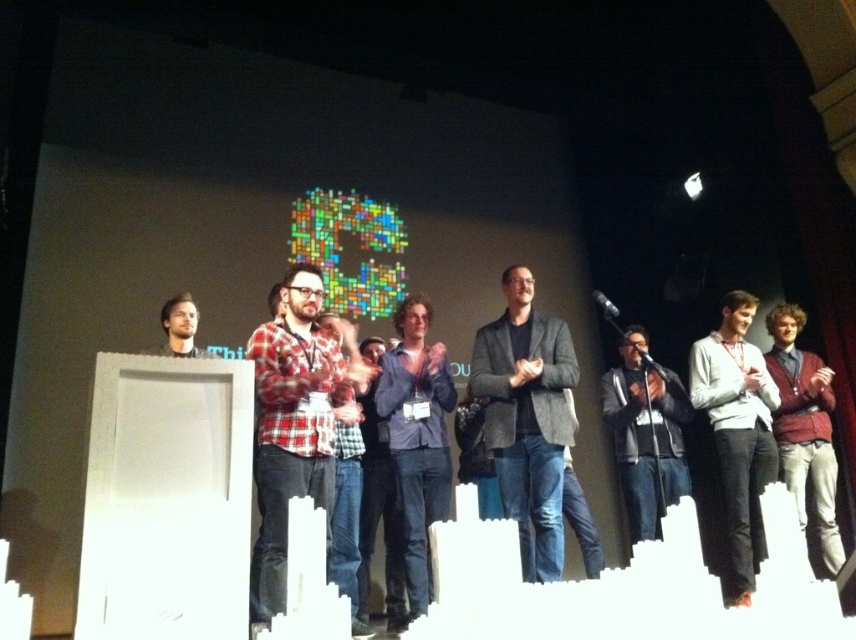
Consider the image. Between white matte shirt at center and matte black shirt at left, which one has more height?

With more height is white matte shirt at center.

Between white matte shirt at center and matte black shirt at left, which one is positioned lower?

Positioned lower is white matte shirt at center.

Measure the distance between white matte shirt at center and camera.

→ A distance of 3.42 meters exists between white matte shirt at center and camera.

Identify the location of white matte shirt at center. (736, 428).

Which is behind, point (446, 368) or point (843, 563)?

Point (446, 368)

Can you confirm if blue denim jeans at center is positioned below matte black podium at center?

No, blue denim jeans at center is not below matte black podium at center.

This screenshot has width=856, height=640. Describe the element at coordinates (415, 436) in the screenshot. I see `blue denim jeans at center` at that location.

Locate an element on the screen. The image size is (856, 640). blue denim jeans at center is located at coordinates (415, 436).

Which is in front, point (614, 444) or point (171, 310)?

Point (171, 310) is more forward.

Is point (607, 396) less distant than point (162, 324)?

No, it is behind (162, 324).

Identify the location of dark gray sweater at center. (645, 433).